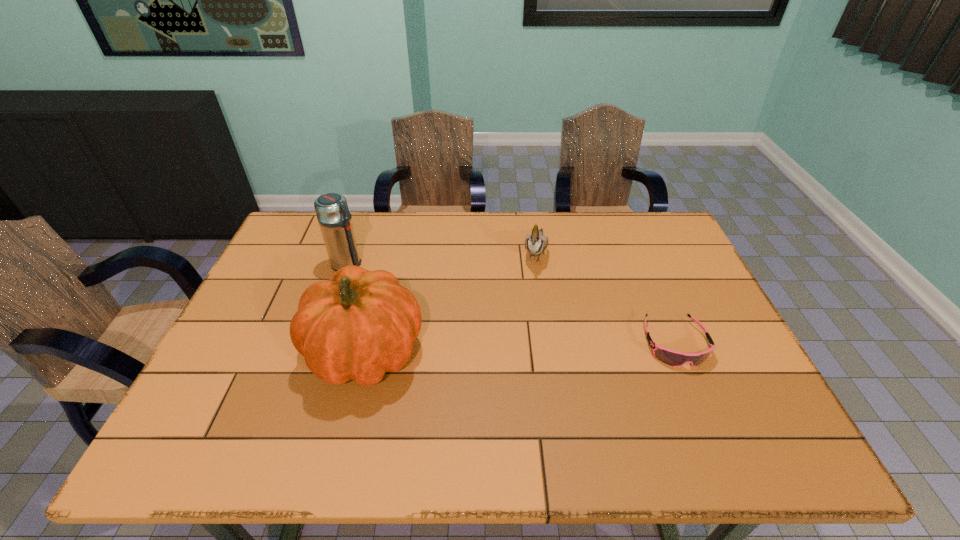
The height and width of the screenshot is (540, 960). Identify the location of vacant area at the far left corner of the desktop. (286, 248).

You are a GUI agent. You are given a task and a screenshot of the screen. Output one action in this format:
    pyautogui.click(x=<x>, y=<y>)
    Task: Click on the free region at the far right corner of the desktop
    
    Given the screenshot: What is the action you would take?
    pyautogui.click(x=636, y=221)

Locate an element on the screen. Image resolution: width=960 pixels, height=540 pixels. vacant space in between the pumpkin and the goggles is located at coordinates (520, 347).

Where is `vacant area that lies between the thermos bottle and the bird`? vacant area that lies between the thermos bottle and the bird is located at coordinates tap(442, 258).

At what (x,y) coordinates should I click in order to perform the action: click on vacant space that's between the second object from right to left and the pumpkin. Please return your answer as a coordinate pair (x, y). Looking at the image, I should click on (450, 301).

This screenshot has width=960, height=540. Identify the location of unoccupied position between the pumpkin and the shortest object. (520, 347).

Locate an element on the screen. The image size is (960, 540). free space between the pumpkin and the second shortest object is located at coordinates (450, 301).

At what (x,y) coordinates should I click in order to perform the action: click on vacant area that lies between the second object from right to left and the pumpkin. Please return your answer as a coordinate pair (x, y). Looking at the image, I should click on (450, 301).

You are a GUI agent. You are given a task and a screenshot of the screen. Output one action in this format:
    pyautogui.click(x=<x>, y=<y>)
    Task: Click on the free space between the rightmost object and the pumpkin
    
    Given the screenshot: What is the action you would take?
    pyautogui.click(x=520, y=347)

Locate which object is the second closest to the rightmost object. Please provide its 2D coordinates. Your answer should be formatted as a tuple, i.e. [(x, y)], where the tuple contains the x and y coordinates of a point satisfying the conditions above.

[(360, 324)]